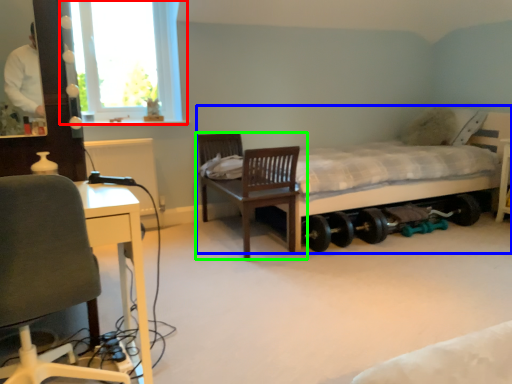
Question: Estimate the real-world distances between objects in this image. Which object is farther from window (highlighted by a red box), bed (highlighted by a blue box) or chair (highlighted by a green box)?

Choices:
 (A) bed
 (B) chair

Answer: (A)